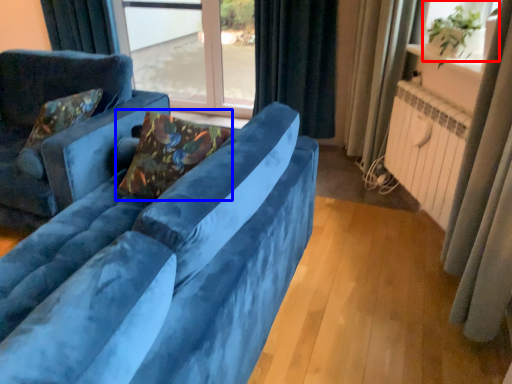
Question: Which point is closer to the camera, window screen (highlighted by a red box) or pillow (highlighted by a blue box)?

Choices:
 (A) window screen
 (B) pillow

Answer: (B)